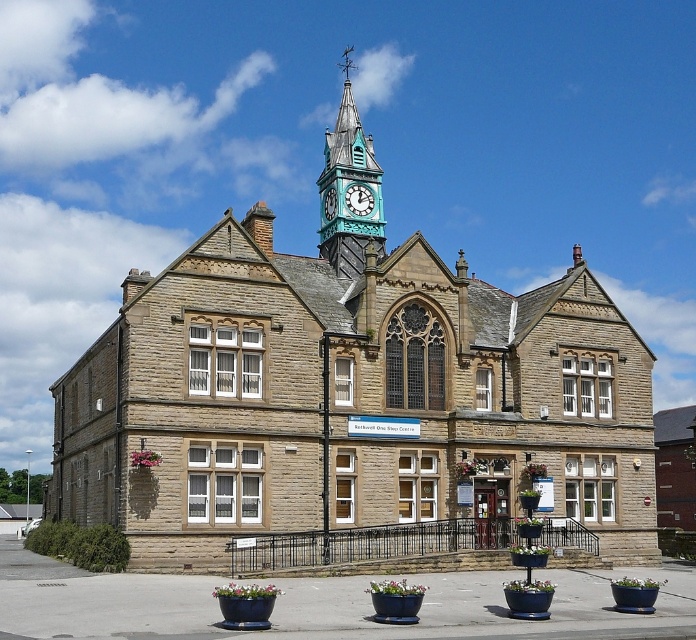
Question: Does teal glass clock tower at upper center have a smaller size compared to teal metallic clock at upper center?

Choices:
 (A) yes
 (B) no

Answer: (B)

Question: Which point is farther to the camera?

Choices:
 (A) (326, 209)
 (B) (370, 208)

Answer: (A)

Question: Does brown stone church at center have a larger size compared to teal glass clock tower at upper center?

Choices:
 (A) yes
 (B) no

Answer: (A)

Question: Among these points, which one is farthest from the camera?

Choices:
 (A) click(x=374, y=208)
 (B) click(x=429, y=266)
 (C) click(x=348, y=205)
 (D) click(x=333, y=193)

Answer: (A)

Question: Among these points, which one is nearest to the camera?

Choices:
 (A) (333, 211)
 (B) (381, 208)

Answer: (A)

Question: Is teal glass clock tower at upper center bigger than teal metallic clock at upper center?

Choices:
 (A) no
 (B) yes

Answer: (B)